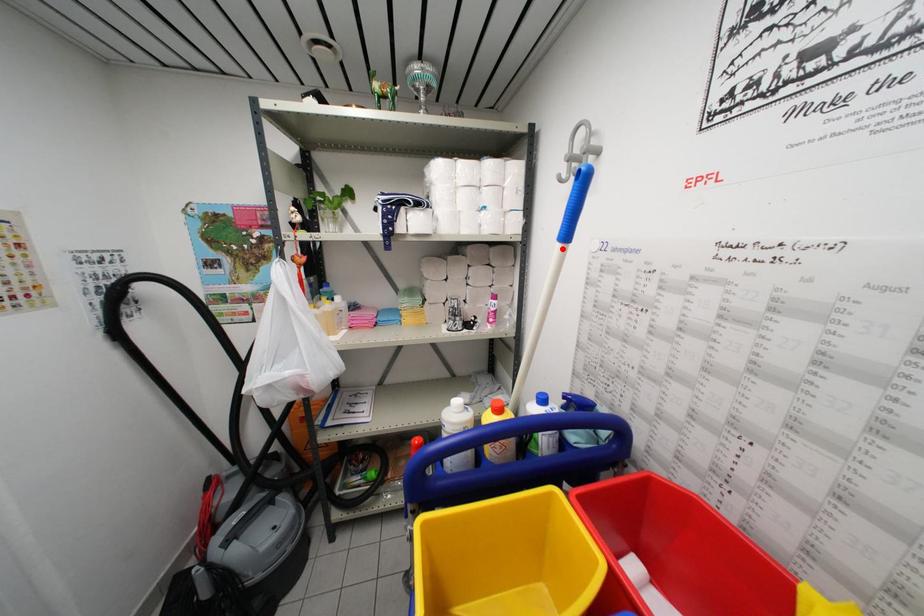
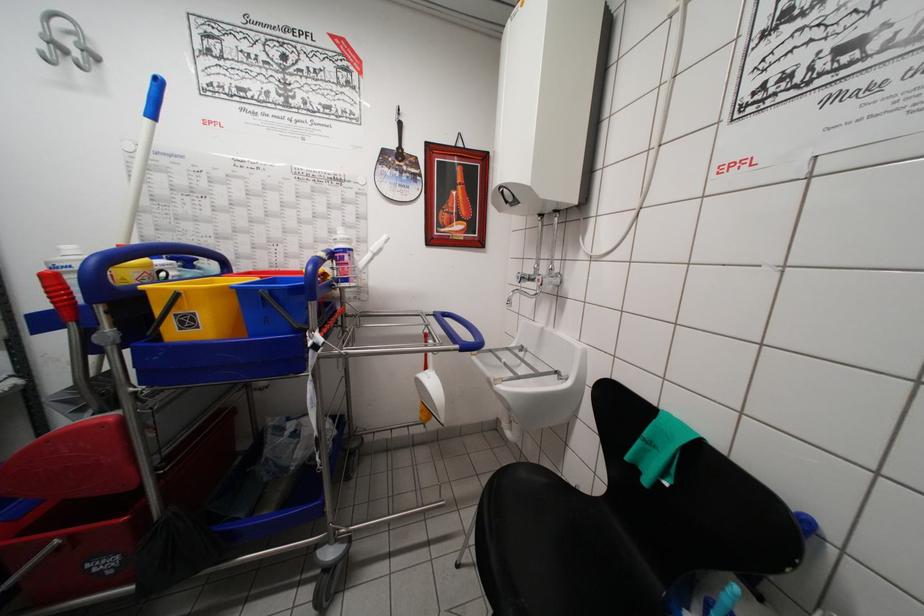
Find the pixel in the second image that matches the highlighted location in the first image.

(151, 124)